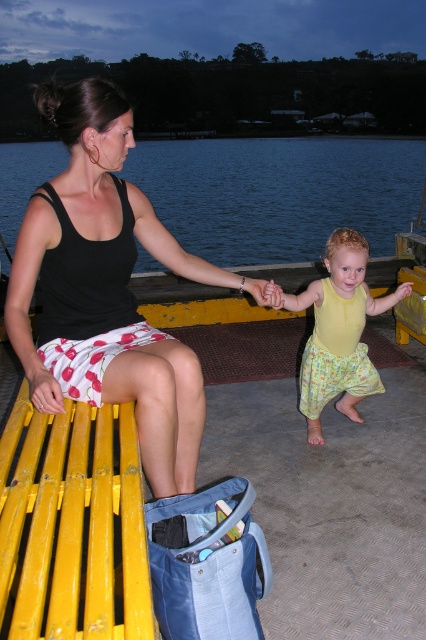
Based on the scene, which object is positioned to the right of the other? The black matte tank top at left or the blue water at upper center?

The black matte tank top at left is positioned to the right of the blue water at upper center according to the description.

You are an artist planning to paint this scene. You want to ensure the black matte tank top at left is not wider than the blue water at upper center in your painting. Is this already the case in the original image?

Yes, the black matte tank top at left is already narrower than the blue water at upper center in the original image, so you don not need to adjust its width in your painting.